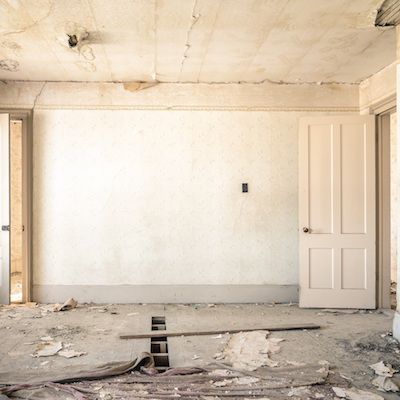
You are a GUI agent. You are given a task and a screenshot of the screen. Output one action in this format:
    pyautogui.click(x=<x>, y=<y>)
    Task: Click on the wall
    
    Given the screenshot: What is the action you would take?
    pyautogui.click(x=151, y=197)